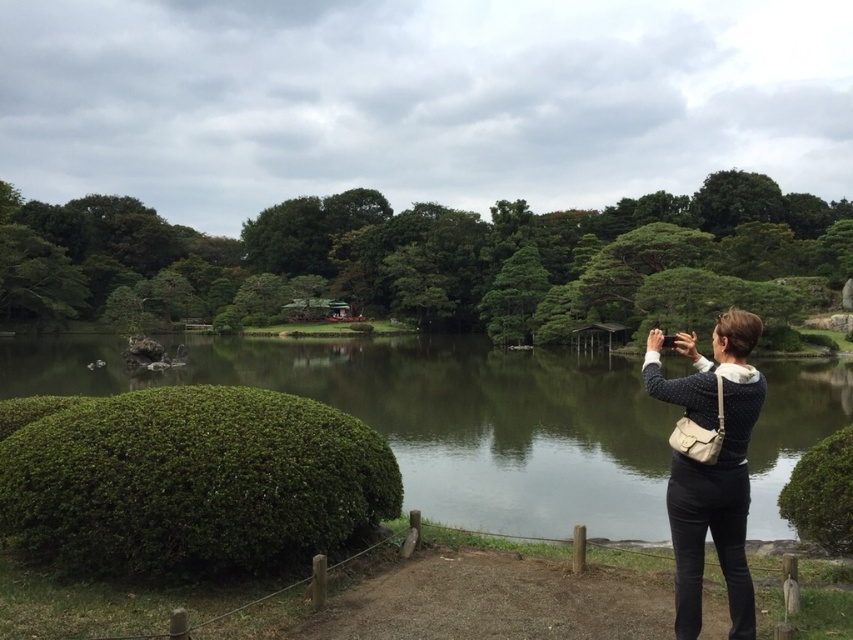
Question: Does green grassy mound at lower left have a larger size compared to knitted sweater at center?

Choices:
 (A) yes
 (B) no

Answer: (A)

Question: Is green grassy mound at lower left below green bushy hedge at lower left?

Choices:
 (A) yes
 (B) no

Answer: (A)

Question: Based on their relative distances, which object is nearer to the knitted sweater at center?

Choices:
 (A) green leafy tree at center
 (B) green grassy mound at lower left

Answer: (B)

Question: Can you confirm if green grassy mound at lower left is smaller than knitted sweater at center?

Choices:
 (A) no
 (B) yes

Answer: (A)

Question: Considering the real-world distances, which object is farthest from the green leafy tree at center?

Choices:
 (A) green bushy hedge at lower left
 (B) green leafy hedge at lower right
 (C) green grassy mound at lower left

Answer: (B)

Question: Among these objects, which one is nearest to the camera?

Choices:
 (A) knitted sweater at center
 (B) green bushy hedge at lower left
 (C) green leafy tree at center

Answer: (A)